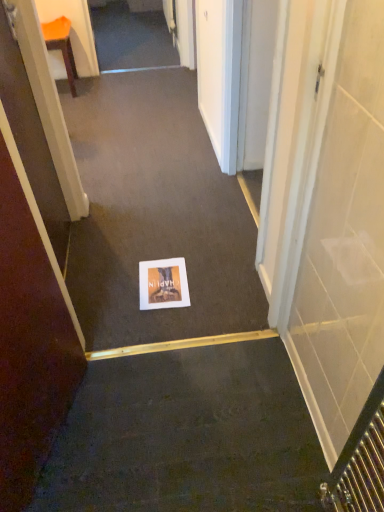
Locate an element on the screen. This screenshot has height=512, width=384. free point in front of matte paper postcard at center is located at coordinates (167, 329).